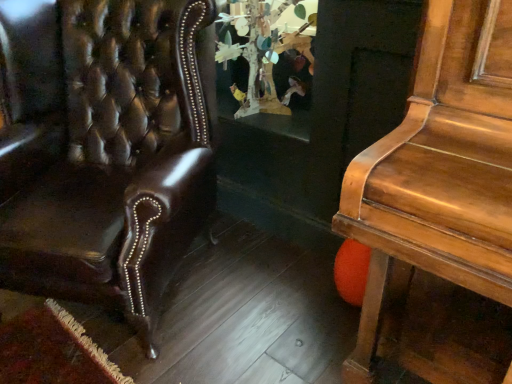
Question: From a real-world perspective, is shiny brown leather chair at left positioned above or below wooden tree sculpture at center?

Choices:
 (A) above
 (B) below

Answer: (B)

Question: In terms of height, does shiny brown leather chair at left look taller or shorter compared to wooden tree sculpture at center?

Choices:
 (A) short
 (B) tall

Answer: (B)

Question: Based on their positions, is shiny brown leather chair at left located to the left or right of wooden tree sculpture at center?

Choices:
 (A) right
 (B) left

Answer: (B)

Question: Is point coord(309,1) positioned closer to the camera than point coord(81,57)?

Choices:
 (A) farther
 (B) closer

Answer: (A)

Question: Considering the relative positions of wooden tree sculpture at center and shiny brown leather chair at left in the image provided, is wooden tree sculpture at center to the left or to the right of shiny brown leather chair at left?

Choices:
 (A) right
 (B) left

Answer: (A)

Question: From a real-world perspective, is wooden tree sculpture at center above or below shiny brown leather chair at left?

Choices:
 (A) below
 (B) above

Answer: (B)

Question: Considering the positions of wooden tree sculpture at center and shiny brown leather chair at left in the image, is wooden tree sculpture at center taller or shorter than shiny brown leather chair at left?

Choices:
 (A) tall
 (B) short

Answer: (B)